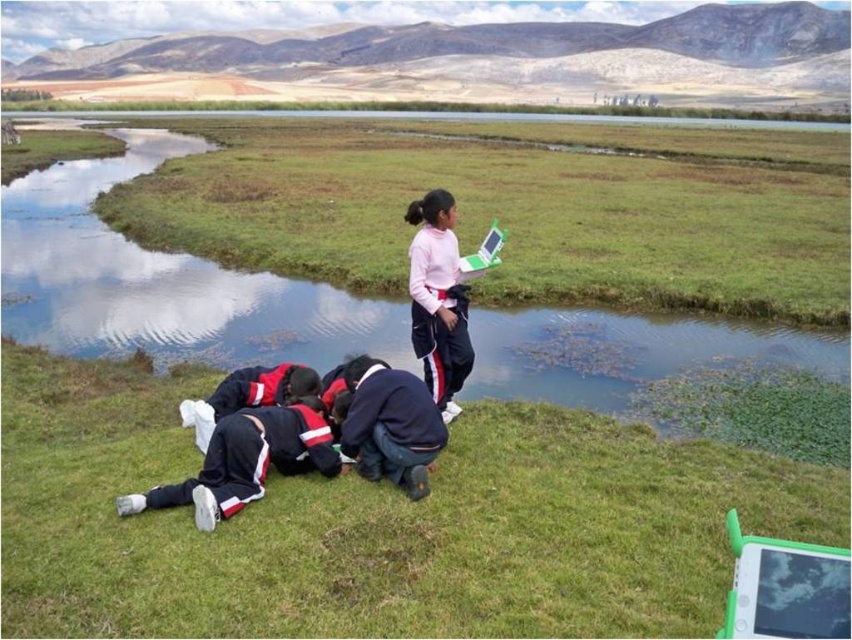
Describe the element at coordinates (163, 282) in the screenshot. I see `green plastic creek at center` at that location.

Who is positioned more to the left, green plastic creek at center or pink matte sweater at upper center?

Positioned to the left is green plastic creek at center.

Measure the distance between point (151, 321) and camera.

Point (151, 321) is 34.96 feet away from camera.

The width and height of the screenshot is (852, 640). Identify the location of green plastic creek at center. (163, 282).

Is green grass at lower center above dark blue tracksuit at lower left?

Incorrect, green grass at lower center is not positioned above dark blue tracksuit at lower left.

Is green grass at lower center to the right of dark blue tracksuit at lower left from the viewer's perspective?

Correct, you'll find green grass at lower center to the right of dark blue tracksuit at lower left.

Find the location of a particular element. The image size is (852, 640). green grass at lower center is located at coordinates (377, 524).

I want to click on green grass at lower center, so click(x=377, y=524).

How distant is green grass at lower center from dark blue fabric pants at lower center?

A distance of 1.07 meters exists between green grass at lower center and dark blue fabric pants at lower center.

Based on the photo, does green grass at lower center appear on the right side of dark blue fabric pants at lower center?

Incorrect, green grass at lower center is not on the right side of dark blue fabric pants at lower center.

Does point (9, 589) come farther from viewer compared to point (346, 412)?

No, (9, 589) is in front of (346, 412).

Locate an element on the screen. Image resolution: width=852 pixels, height=640 pixels. green grass at lower center is located at coordinates (377, 524).